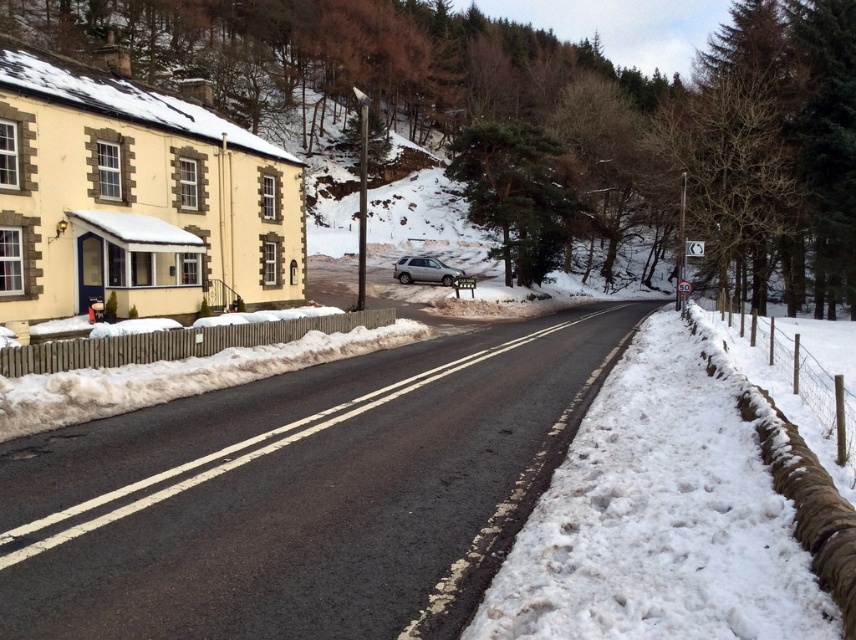
Measure the distance from white fluffy snow at road right to satin silver suv at center.

white fluffy snow at road right is 136.64 feet from satin silver suv at center.

Which is in front, point (797, 508) or point (428, 266)?

Point (797, 508) is more forward.

This screenshot has width=856, height=640. Find the location of `white fluffy snow at road right`. white fluffy snow at road right is located at coordinates (663, 515).